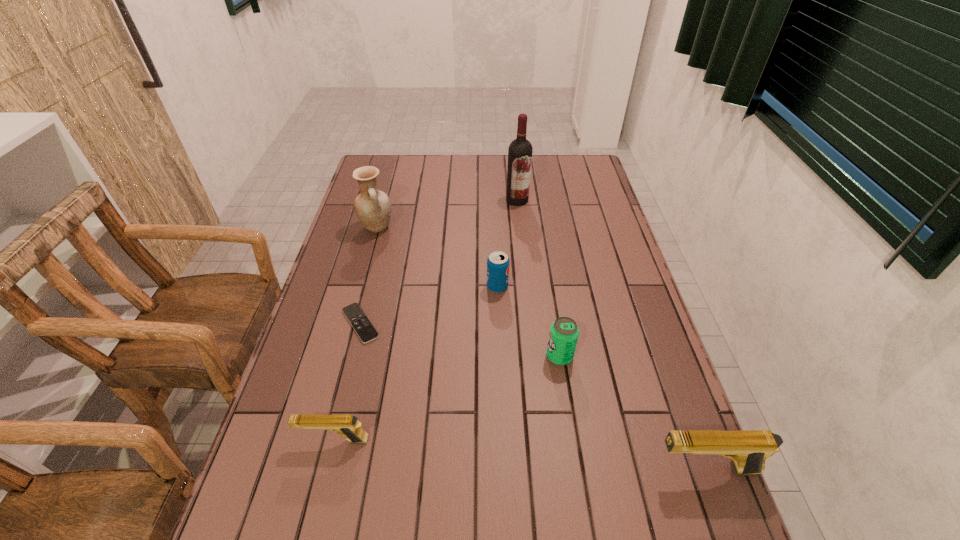
You are a GUI agent. You are given a task and a screenshot of the screen. Output one action in this format:
    pyautogui.click(x=<x>, y=<y>)
    Task: Click on the empty location between the farther soda can and the sixth nearest object
    The width and height of the screenshot is (960, 540).
    Given the screenshot: What is the action you would take?
    pyautogui.click(x=437, y=257)

Where is `free point between the third farthest object and the shorter pistol`? This screenshot has height=540, width=960. free point between the third farthest object and the shorter pistol is located at coordinates (416, 363).

The height and width of the screenshot is (540, 960). I want to click on vacant space that is in between the tallest object and the second tallest object, so click(x=447, y=214).

Find the location of a particular element. Image resolution: width=960 pixels, height=540 pixels. free space between the second nearest object and the wine bottle is located at coordinates (425, 320).

This screenshot has height=540, width=960. Find the location of `unoccupied position between the tallest object and the rightmost object`. unoccupied position between the tallest object and the rightmost object is located at coordinates (612, 334).

At what (x,y) coordinates should I click in order to perform the action: click on free area in between the sixth tallest object and the third nearest object. Please return your answer as a coordinate pair (x, y). Looking at the image, I should click on (446, 398).

The width and height of the screenshot is (960, 540). Find the location of `blank region between the right soda can and the farthest object`. blank region between the right soda can and the farthest object is located at coordinates tap(539, 278).

What are the coordinates of `object that is the nearest to the right soda can` in the screenshot? It's located at (498, 262).

Select which object is the fifth closest to the tallest object. Please provide its 2D coordinates. Your answer should be formatted as a tuple, i.e. [(x, y)], where the tuple contains the x and y coordinates of a point satisfying the conditions above.

[(347, 425)]

Locate an element on the screen. This screenshot has height=540, width=960. free space that satisfies the following two spatial constraints: 1. on the label of the farthest object; 2. at the barrel of the second nearest object is located at coordinates (542, 440).